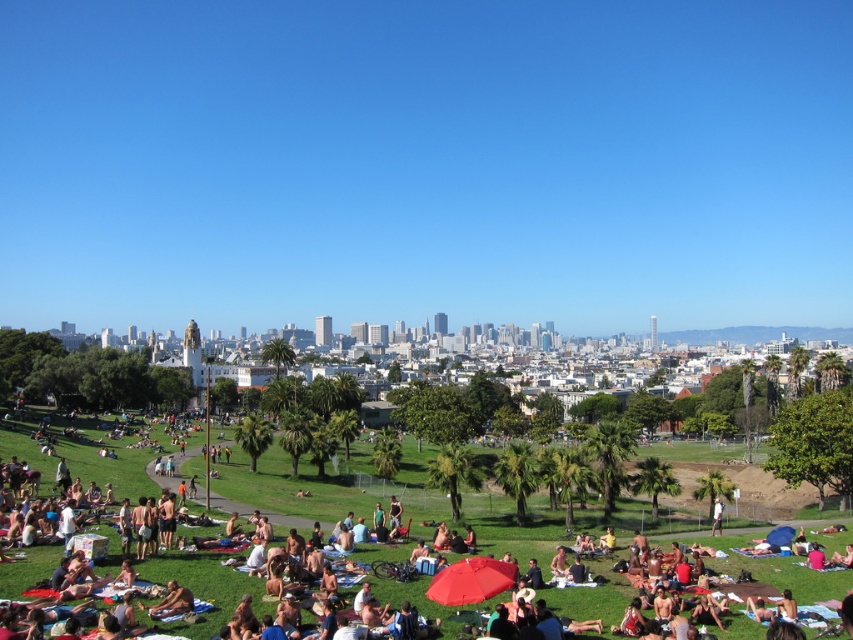
Question: Which point is farther from the camera taking this photo?

Choices:
 (A) (601, 556)
 (B) (152, 611)

Answer: (A)

Question: Which of the following is the farthest from the observer?

Choices:
 (A) matte black tent at center
 (B) tan skin person at lower left

Answer: (B)

Question: Is matte black tent at center bigger than tan skin person at lower left?

Choices:
 (A) yes
 (B) no

Answer: (A)

Question: Is matte black tent at center wider than tan skin person at lower left?

Choices:
 (A) yes
 (B) no

Answer: (A)

Question: Where is matte black tent at center located in relation to tan skin person at lower left in the image?

Choices:
 (A) right
 (B) left

Answer: (A)